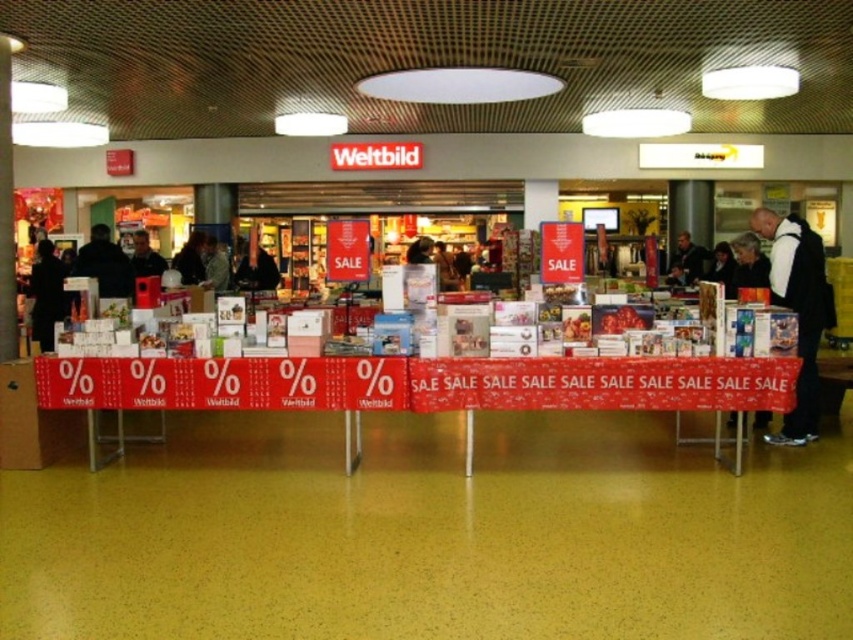
Can you confirm if dark gray suit at center is thinner than dark gray sweater at center?

No.

Is dark gray suit at center wider than dark gray sweater at center?

Correct, the width of dark gray suit at center exceeds that of dark gray sweater at center.

The image size is (853, 640). Find the location of `dark gray suit at center`. dark gray suit at center is located at coordinates tap(688, 260).

Can you confirm if dark gray coat at left is shorter than dark gray sweater at center?

No, dark gray coat at left is not shorter than dark gray sweater at center.

Between dark gray coat at left and dark gray sweater at center, which one has less height?

With less height is dark gray sweater at center.

Who is more distant from viewer, (44, 301) or (134, 266)?

Positioned behind is point (134, 266).

Where is `dark gray coat at left`? dark gray coat at left is located at coordinates (45, 294).

Is the position of red fabric banner at center more distant than that of dark hair at center?

No, red fabric banner at center is closer to the viewer.

Does red fabric banner at center have a lesser height compared to dark hair at center?

In fact, red fabric banner at center may be taller than dark hair at center.

Is point (94, 368) in front of point (190, 232)?

Yes, point (94, 368) is closer to viewer.

At what (x,y) coordinates should I click in order to perform the action: click on red fabric banner at center. Please return your answer as a coordinate pair (x, y). Looking at the image, I should click on (416, 384).